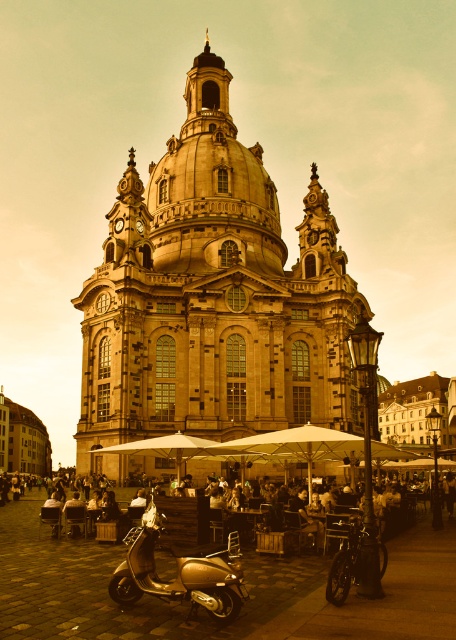
Question: Which point is farther from the camera taking this photo?

Choices:
 (A) (157, 371)
 (B) (234, 449)
 (C) (41, 502)

Answer: (C)

Question: Does golden stone church at center appear over gold metallic scooter at center?

Choices:
 (A) no
 (B) yes

Answer: (B)

Question: Which object is the farthest from the golden stone church at center?

Choices:
 (A) matte black scooter at lower left
 (B) white fabric umbrella at center

Answer: (A)

Question: Which point is closer to the camera?

Choices:
 (A) gold metallic scooter at lower left
 (B) gold metallic scooter at center
 (C) matte black scooter at lower left

Answer: (B)

Question: Considering the relative positions of golden stone church at center and matte black scooter at lower left in the image provided, where is golden stone church at center located with respect to matte black scooter at lower left?

Choices:
 (A) below
 (B) above

Answer: (B)

Question: Is gold metallic scooter at center thinner than matte black scooter at lower left?

Choices:
 (A) no
 (B) yes

Answer: (B)